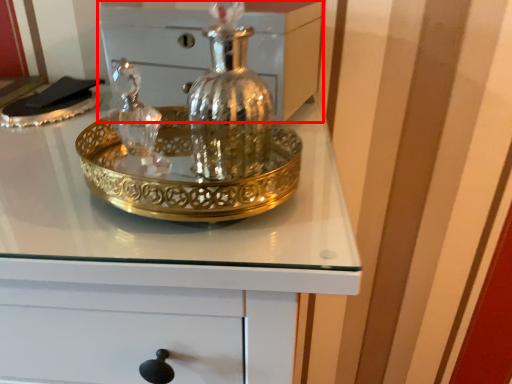
Question: From the image's perspective, what is the correct spatial relationship of chest (annotated by the red box) in relation to chest of drawers?

Choices:
 (A) above
 (B) below

Answer: (A)